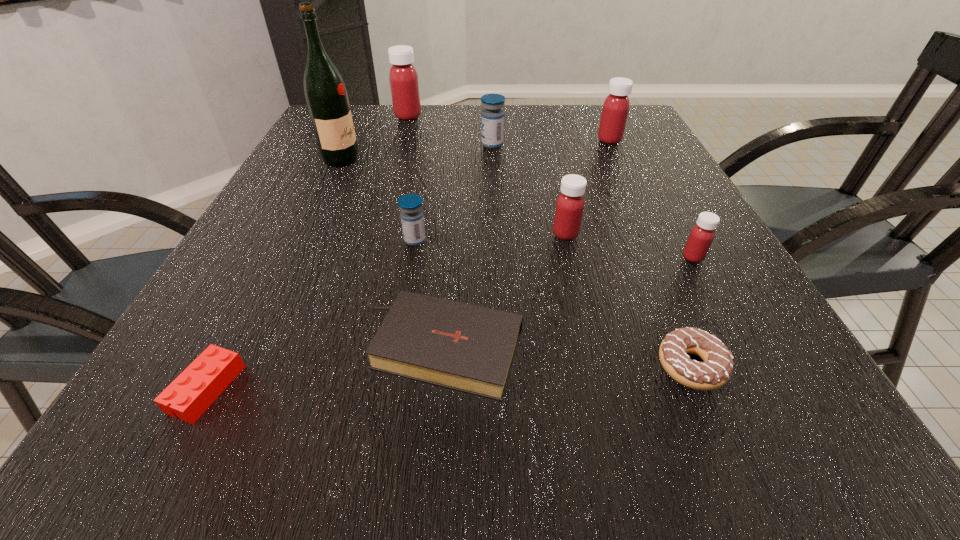
Locate an element on the screen. Lego located in the left edge section of the desktop is located at coordinates (199, 385).

I want to click on doughnut at the right edge, so click(x=715, y=371).

Locate an element on the screen. This screenshot has height=540, width=960. object at the near left corner is located at coordinates (199, 385).

Locate an element on the screen. object at the far right corner is located at coordinates (616, 106).

The image size is (960, 540). Find the location of `blank space at the far edge`. blank space at the far edge is located at coordinates (468, 130).

The image size is (960, 540). Identify the location of free region at the near edge. (635, 448).

The height and width of the screenshot is (540, 960). In order to click on free space at the left edge of the desktop in this screenshot , I will do `click(299, 191)`.

Where is `vacant position at the right edge of the desktop`? This screenshot has width=960, height=540. vacant position at the right edge of the desktop is located at coordinates (712, 260).

Identify the location of vacant space at the far left corner. (373, 123).

Locate an element on the screen. The width and height of the screenshot is (960, 540). blank area at the near right corner is located at coordinates (827, 413).